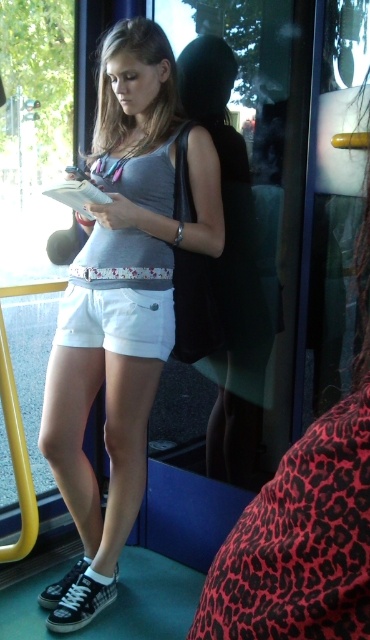
Is matte gray tank top at center taller than white cotton shorts at center?

Yes.

This screenshot has height=640, width=370. What do you see at coordinates (122, 304) in the screenshot?
I see `matte gray tank top at center` at bounding box center [122, 304].

At what (x,y) coordinates should I click in order to perform the action: click on matte gray tank top at center. Please return your answer as a coordinate pair (x, y). Looking at the image, I should click on (122, 304).

Who is shorter, matte gray tank top at center or leopard print skirt at center?

With less height is leopard print skirt at center.

This screenshot has width=370, height=640. What are the coordinates of `matte gray tank top at center` in the screenshot? It's located at (122, 304).

Is point (351, 541) in front of point (109, 340)?

Yes, point (351, 541) is closer to viewer.

Is leopard print skirt at center shorter than white cotton shorts at center?

In fact, leopard print skirt at center may be taller than white cotton shorts at center.

Looking at this image, who is more forward, (331, 634) or (92, 333)?

Positioned in front is point (331, 634).

Where is `leopard print skirt at center`? The image size is (370, 640). leopard print skirt at center is located at coordinates (304, 524).